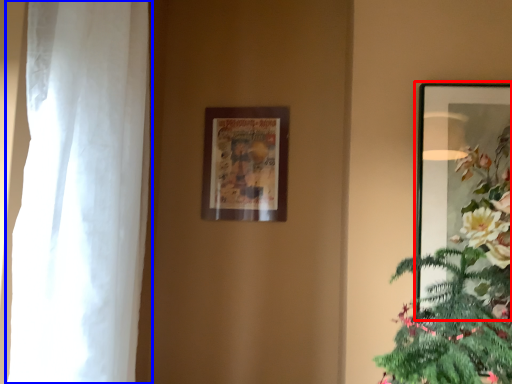
Question: Among these objects, which one is farthest to the camera, picture frame (highlighted by a red box) or curtain (highlighted by a blue box)?

Choices:
 (A) picture frame
 (B) curtain

Answer: (A)